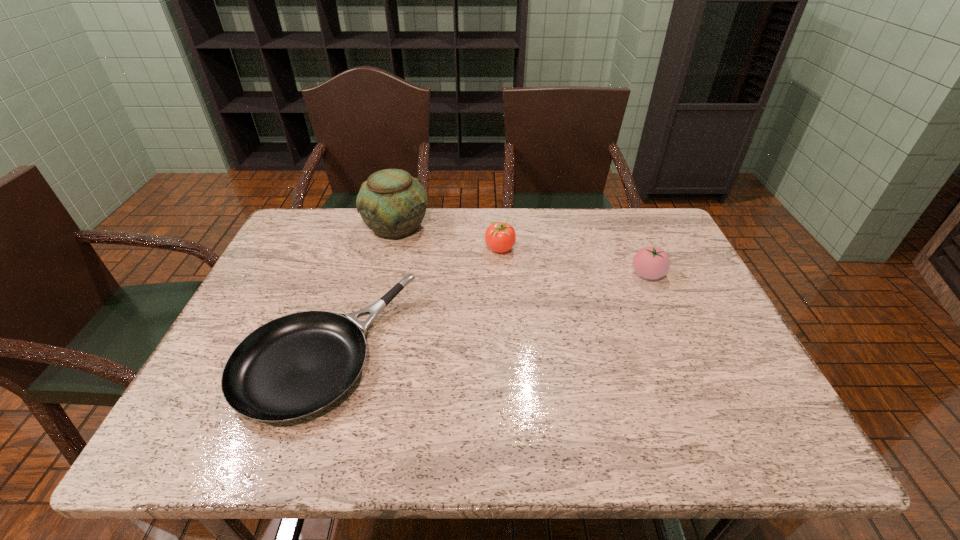
I want to click on free spot between the nearest object and the farther tomato, so click(x=413, y=300).

You are a GUI agent. You are given a task and a screenshot of the screen. Output one action in this format:
    pyautogui.click(x=<x>, y=<y>)
    Task: Click on the object that is the third closest one to the nearest object
    
    Given the screenshot: What is the action you would take?
    pyautogui.click(x=650, y=262)

Identify which object is the nearest to the rightmost object. Please provide its 2D coordinates. Your answer should be formatted as a tuple, i.e. [(x, y)], where the tuple contains the x and y coordinates of a point satisfying the conditions above.

[(500, 237)]

In order to click on vacant area that satisfies the following two spatial constraints: 1. on the back side of the nearest object; 2. on the left side of the farther tomato in this screenshot , I will do `click(361, 248)`.

Locate an element on the screen. The width and height of the screenshot is (960, 540). free space that satisfies the following two spatial constraints: 1. on the front side of the rightmost object; 2. on the right side of the farther tomato is located at coordinates (502, 274).

Identify the location of free space that satisfies the following two spatial constraints: 1. on the front side of the pottery; 2. on the right side of the third object from left to right. (391, 248).